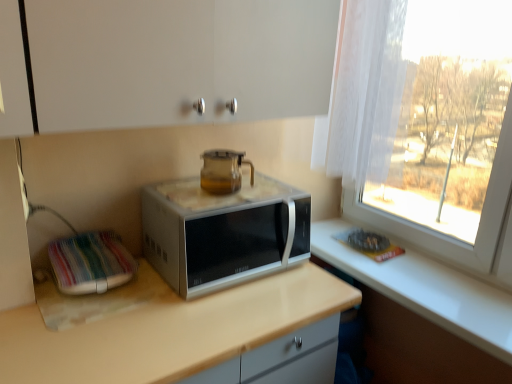
The width and height of the screenshot is (512, 384). In order to click on blank space situated above satin silver microwave at center (from a real-world perspective) in this screenshot , I will do `click(239, 194)`.